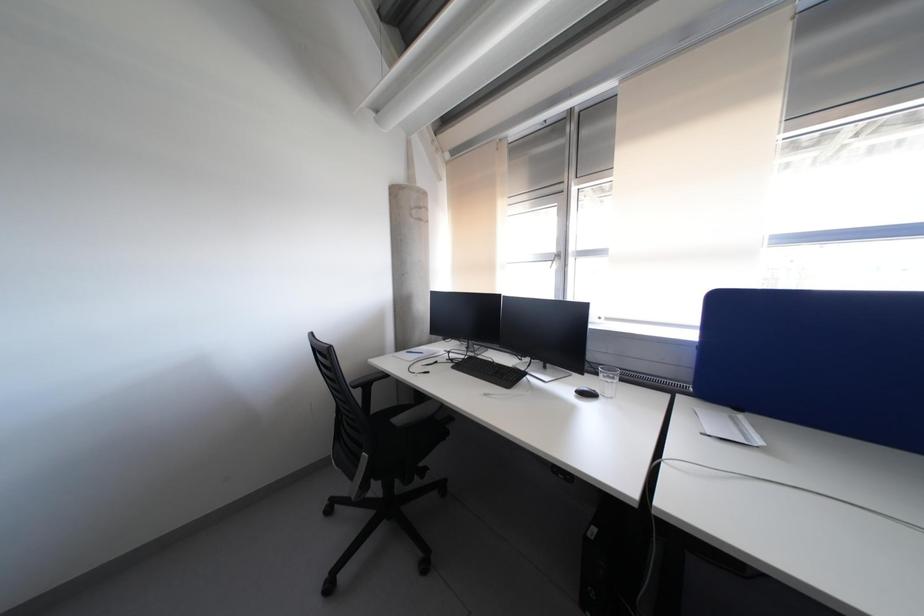
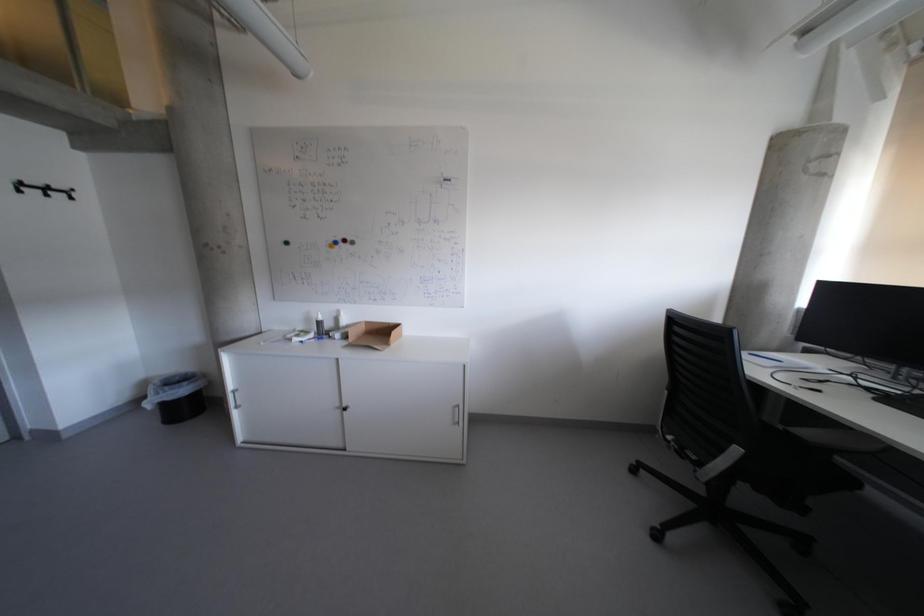
Question: The camera is either moving clockwise (left) or counter-clockwise (right) around the object. The first image is from the beginning of the video and the second image is from the end. Is the camera moving left or right when shooting the video?

Choices:
 (A) Left
 (B) Right

Answer: (B)